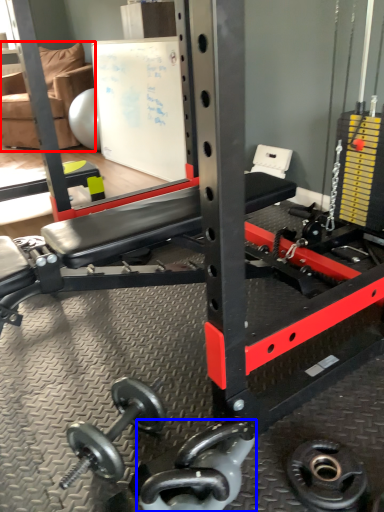
Question: Which point is closer to the camera, chair (highlighted by a red box) or dumbbell (highlighted by a blue box)?

Choices:
 (A) chair
 (B) dumbbell

Answer: (B)